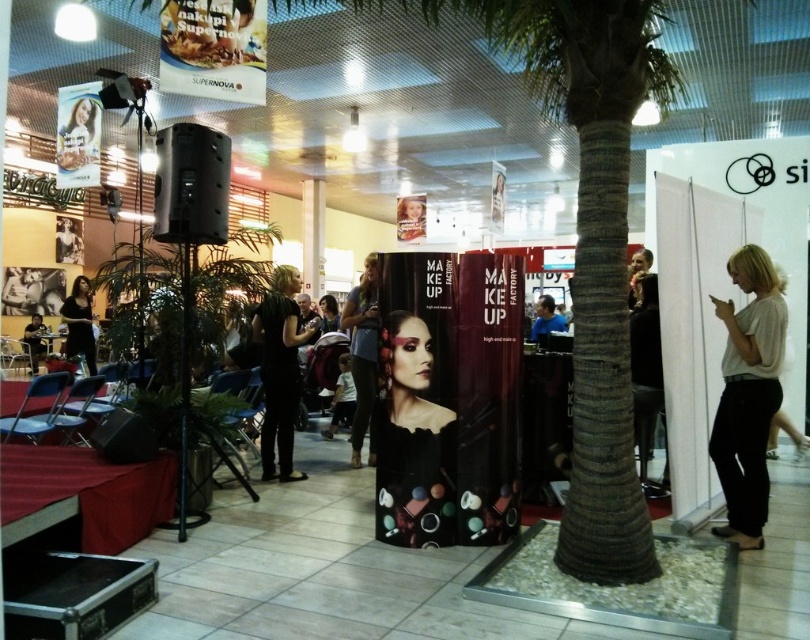
You are an event planner arranging a photoshoot in the described space. You need to position a model wearing the white matte shirt at right and another wearing the black matte dress at left. Considering their current positions, which clothing item will be more visible to the camera positioned at the entrance of the hall?

The white matte shirt at right will be more visible to the camera positioned at the entrance of the hall because it is in front of the black matte dress at left.